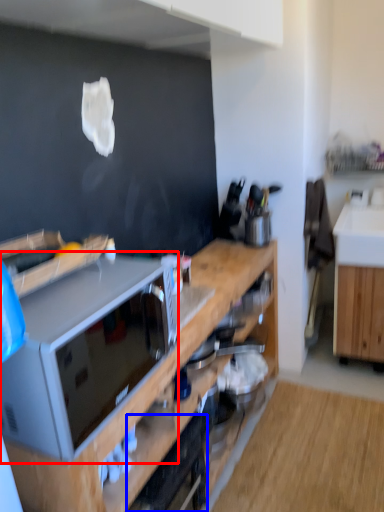
Question: Which object is closer to the camera taking this photo, microwave oven (highlighted by a red box) or appliance (highlighted by a blue box)?

Choices:
 (A) microwave oven
 (B) appliance

Answer: (A)